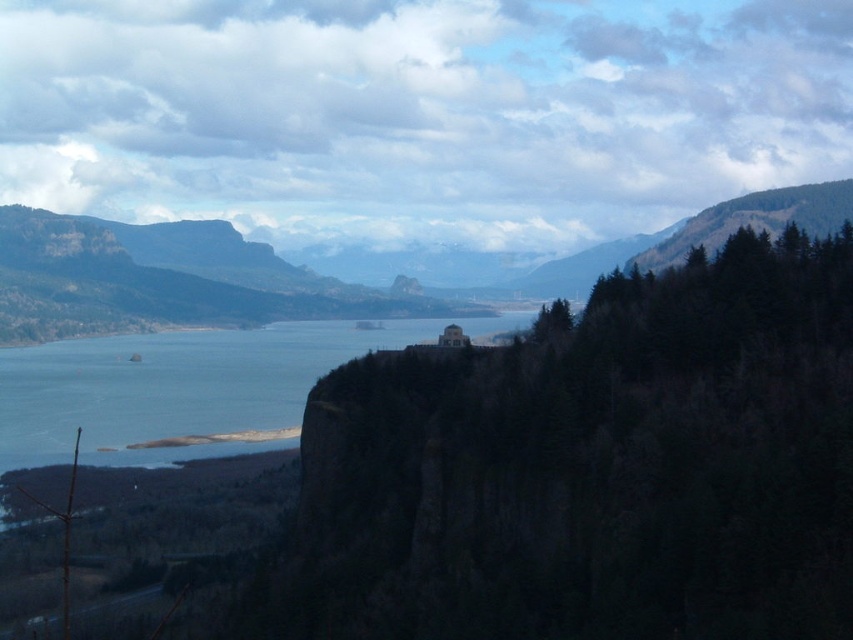
What do you see at coordinates (598, 467) in the screenshot? Image resolution: width=853 pixels, height=640 pixels. I see `dark brown rocky cliff at center` at bounding box center [598, 467].

Between dark brown rocky cliff at center and blue water at center, which one appears on the left side from the viewer's perspective?

Positioned to the left is blue water at center.

This screenshot has height=640, width=853. What do you see at coordinates (598, 467) in the screenshot?
I see `dark brown rocky cliff at center` at bounding box center [598, 467].

Identify the location of dark brown rocky cliff at center. point(598,467).

From the picture: Is green forested mountain at center smaller than blue water at center?

Actually, green forested mountain at center might be larger than blue water at center.

Is green forested mountain at center wider than blue water at center?

Indeed, green forested mountain at center has a greater width compared to blue water at center.

The width and height of the screenshot is (853, 640). I want to click on green forested mountain at center, so (166, 282).

You are a GUI agent. You are given a task and a screenshot of the screen. Output one action in this format:
    pyautogui.click(x=<x>, y=<y>)
    Task: Click on the green forested mountain at center
    
    Given the screenshot: What is the action you would take?
    pyautogui.click(x=166, y=282)

Who is higher up, dark brown rocky cliff at center or green forested mountain at center?

Positioned higher is green forested mountain at center.

Who is more forward, (834, 445) or (22, 328)?

Positioned in front is point (834, 445).

I want to click on dark brown rocky cliff at center, so click(598, 467).